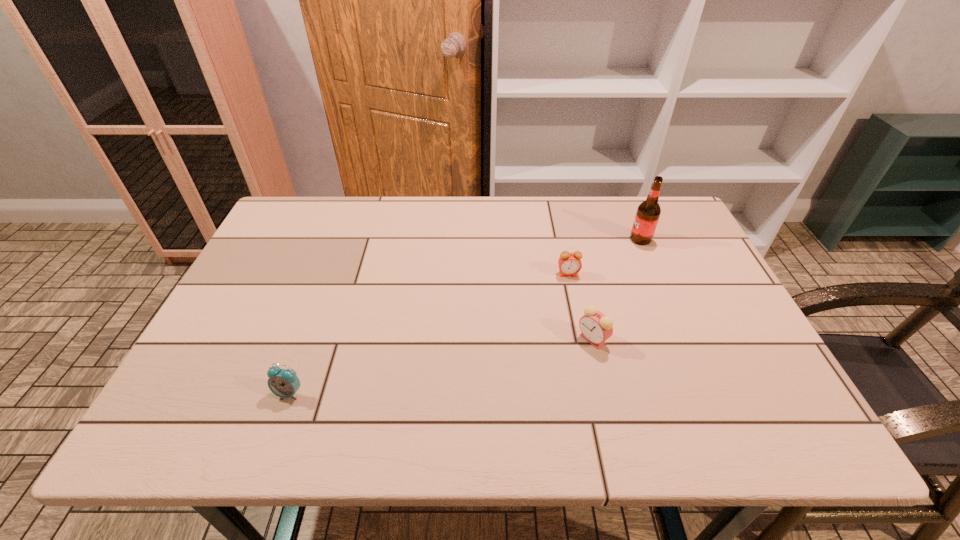
In order to click on unoccupied position between the rightmost object and the farthest alarm clock in this screenshot , I will do `click(604, 256)`.

The height and width of the screenshot is (540, 960). In order to click on vacant area between the farthest object and the leftmost object in this screenshot , I will do `click(465, 316)`.

You are a GUI agent. You are given a task and a screenshot of the screen. Output one action in this format:
    pyautogui.click(x=<x>, y=<y>)
    Task: Click on the vacant area between the farthest alarm clock and the nearest alarm clock
    This screenshot has width=960, height=540.
    Given the screenshot: What is the action you would take?
    pyautogui.click(x=429, y=334)

Identify the location of free space between the root beer and the leftmost alarm clock. (465, 316).

At what (x,y) coordinates should I click in order to perform the action: click on free space between the rightmost object and the third farthest object. Please return your answer as a coordinate pair (x, y). Image resolution: width=960 pixels, height=540 pixels. Looking at the image, I should click on (616, 289).

Find the location of a particular element. This screenshot has height=540, width=960. vacant space that's between the third farthest object and the tallest object is located at coordinates (616, 289).

Image resolution: width=960 pixels, height=540 pixels. I want to click on vacant area that lies between the tallest object and the nearest object, so click(x=465, y=316).

Find the location of a particular element. Image resolution: width=960 pixels, height=540 pixels. empty space that is in between the second farthest object and the nearest alarm clock is located at coordinates (429, 334).

The width and height of the screenshot is (960, 540). I want to click on free spot between the second nearest object and the root beer, so click(x=616, y=289).

The image size is (960, 540). I want to click on free space between the leftmost alarm clock and the farthest alarm clock, so click(x=429, y=334).